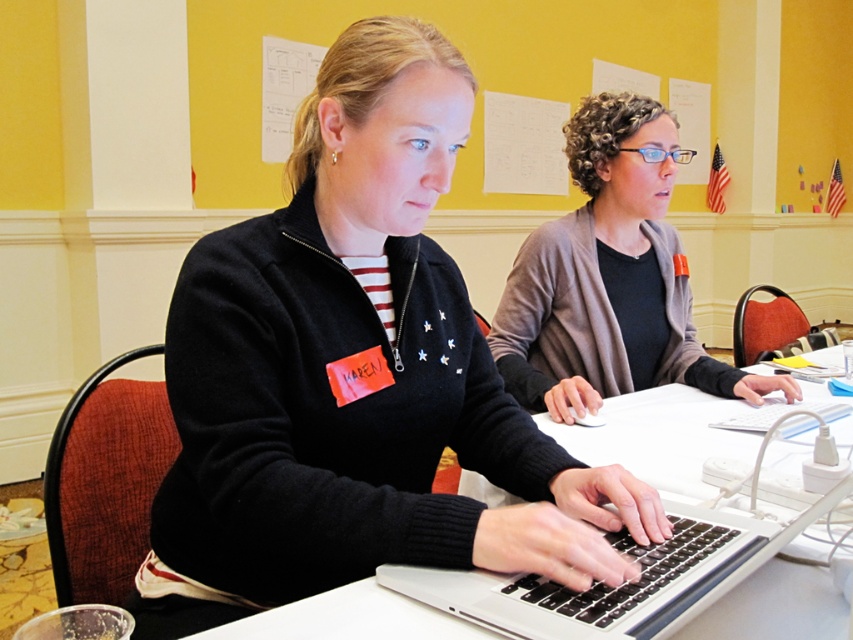
Which is above, white plastic table at center or white paperboard at upper center?

white paperboard at upper center

Who is shorter, white plastic table at center or white paperboard at upper center?

white plastic table at center is shorter.

Between point (321, 595) and point (584, 64), which one is positioned in front?

Positioned in front is point (321, 595).

In order to click on white plastic table at center in this screenshot , I will do (x=347, y=620).

Is point (619, 541) positioned after point (277, 97)?

No, it is in front of (277, 97).

Does point (497, 580) come farther from viewer compared to point (463, 200)?

No, it is not.

Where is `silver/black keyboard at center`? The height and width of the screenshot is (640, 853). silver/black keyboard at center is located at coordinates (621, 582).

Who is shorter, black matte sweater at center or silver/black keyboard at center?

Standing shorter between the two is silver/black keyboard at center.

Which is in front, point (331, 228) or point (737, 529)?

Point (737, 529)

Where is `black matte sweater at center`? The width and height of the screenshot is (853, 640). black matte sweater at center is located at coordinates (354, 376).